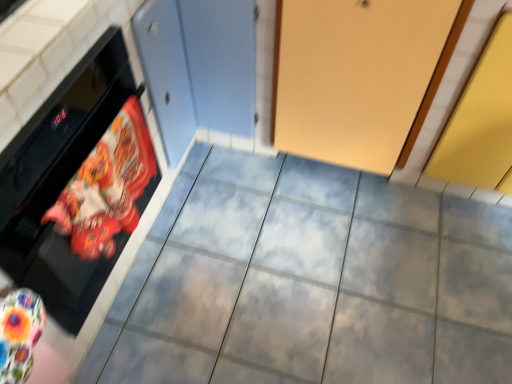
Question: Can you confirm if matte gray tile at center is positioned to the right of printed fabric oven mitt at left?

Choices:
 (A) no
 (B) yes

Answer: (B)

Question: Could you tell me if matte gray tile at center is facing printed fabric oven mitt at left?

Choices:
 (A) no
 (B) yes

Answer: (A)

Question: Can you confirm if matte gray tile at center is bigger than printed fabric oven mitt at left?

Choices:
 (A) no
 (B) yes

Answer: (B)

Question: Is matte gray tile at center with printed fabric oven mitt at left?

Choices:
 (A) no
 (B) yes

Answer: (A)

Question: Considering the relative sizes of matte gray tile at center and printed fabric oven mitt at left in the image provided, is matte gray tile at center taller than printed fabric oven mitt at left?

Choices:
 (A) no
 (B) yes

Answer: (A)

Question: Is black glossy oven at left spatially inside printed fabric oven mitt at left, or outside of it?

Choices:
 (A) outside
 (B) inside

Answer: (A)

Question: Looking at their shapes, would you say black glossy oven at left is wider or thinner than printed fabric oven mitt at left?

Choices:
 (A) thin
 (B) wide

Answer: (B)

Question: Based on their sizes in the image, would you say black glossy oven at left is bigger or smaller than printed fabric oven mitt at left?

Choices:
 (A) small
 (B) big

Answer: (B)

Question: From a real-world perspective, relative to printed fabric oven mitt at left, is black glossy oven at left vertically above or below?

Choices:
 (A) below
 (B) above

Answer: (A)

Question: Looking at their shapes, would you say matte gray tile at center is wider or thinner than printed fabric oven mitt at left?

Choices:
 (A) wide
 (B) thin

Answer: (A)

Question: In terms of size, does matte gray tile at center appear bigger or smaller than printed fabric oven mitt at left?

Choices:
 (A) big
 (B) small

Answer: (A)

Question: From their relative heights in the image, would you say matte gray tile at center is taller or shorter than printed fabric oven mitt at left?

Choices:
 (A) tall
 (B) short

Answer: (B)

Question: From a real-world perspective, is matte gray tile at center physically located above or below printed fabric oven mitt at left?

Choices:
 (A) below
 (B) above

Answer: (A)

Question: In terms of height, does printed fabric oven mitt at left look taller or shorter compared to matte gray tile at center?

Choices:
 (A) short
 (B) tall

Answer: (B)

Question: In terms of size, does printed fabric oven mitt at left appear bigger or smaller than matte gray tile at center?

Choices:
 (A) big
 (B) small

Answer: (B)